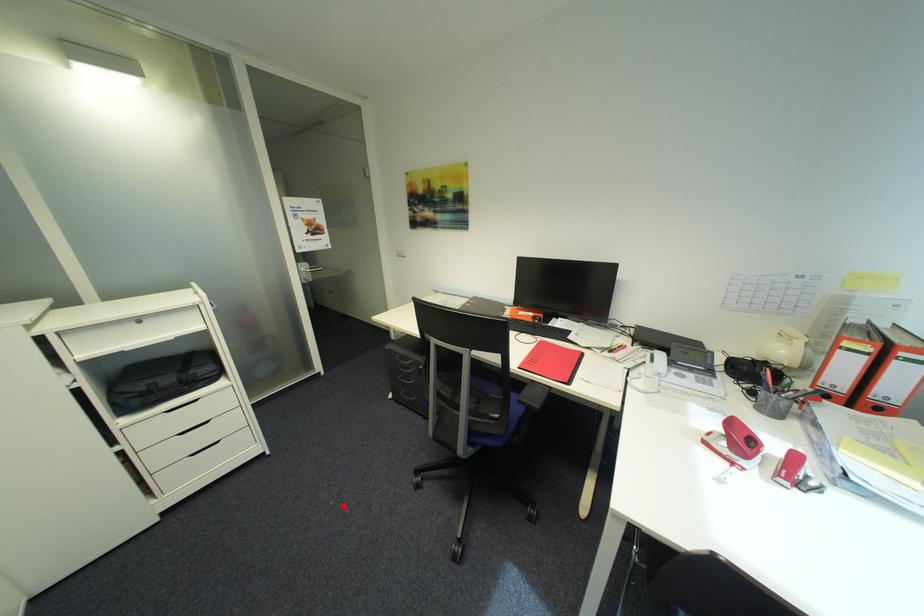
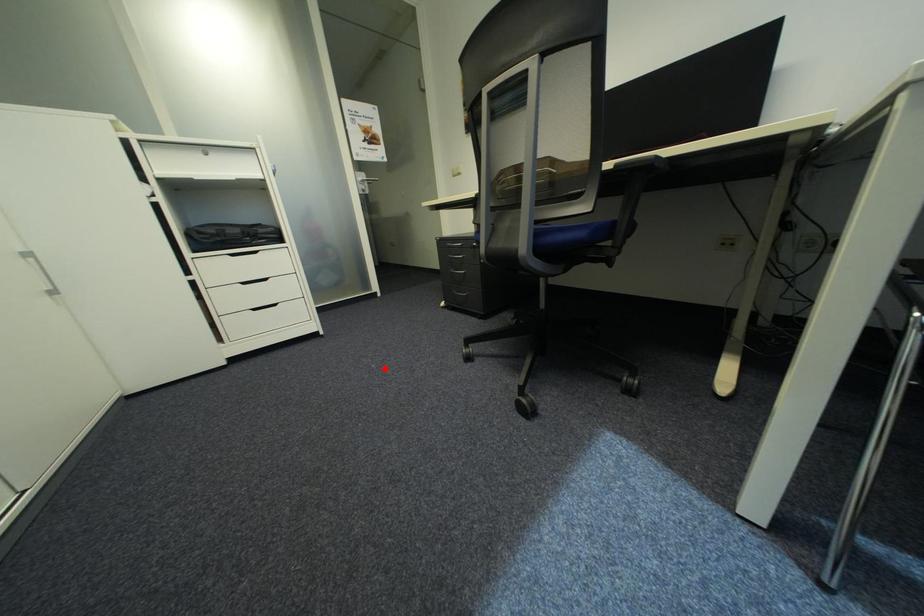
I am providing you with two images of the same scene from different viewpoints. A red point is marked on the first image and another point is marked on the second image. Do the highlighted points in image1 and image2 indicate the same real-world spot?

Yes